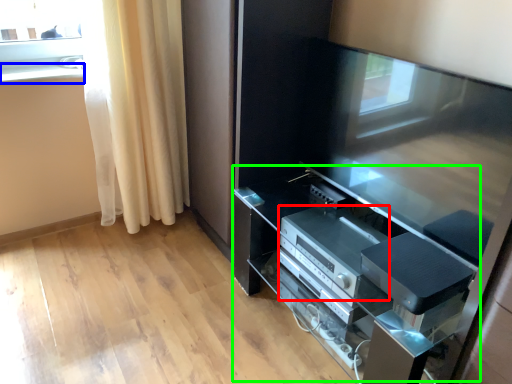
Question: Which is farther away from appliance (highlighted by a red box)? window sill (highlighted by a blue box) or tv cabinet (highlighted by a green box)?

Choices:
 (A) window sill
 (B) tv cabinet

Answer: (A)